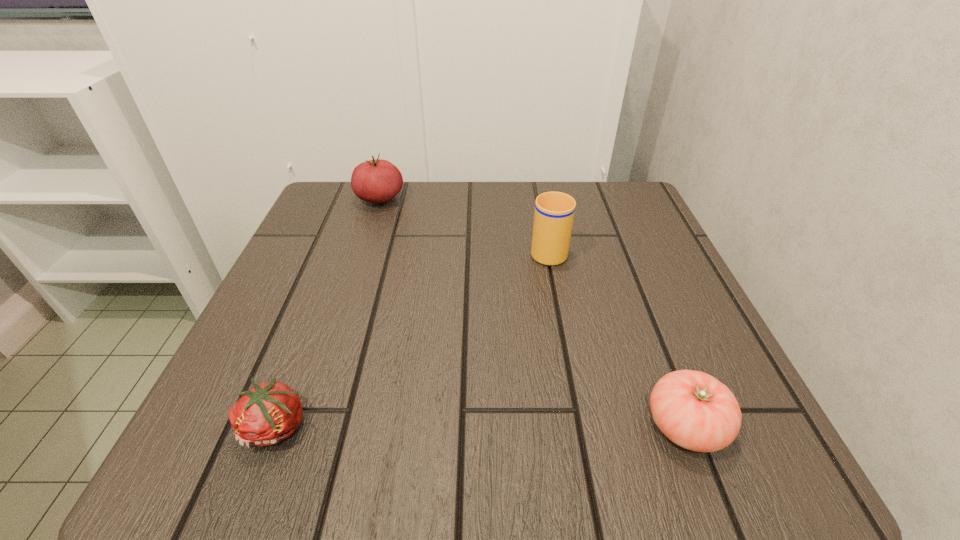
At what (x,y) coordinates should I click in order to perform the action: click on object that stands as the second closest to the tallest tomato. Please return your answer as a coordinate pair (x, y). Looking at the image, I should click on (268, 413).

The width and height of the screenshot is (960, 540). In order to click on tomato that stands as the second closest to the rightmost tomato in this screenshot , I will do pos(376,181).

Point out which tomato is positioned as the second nearest to the farthest tomato. Please provide its 2D coordinates. Your answer should be formatted as a tuple, i.e. [(x, y)], where the tuple contains the x and y coordinates of a point satisfying the conditions above.

[(693, 409)]